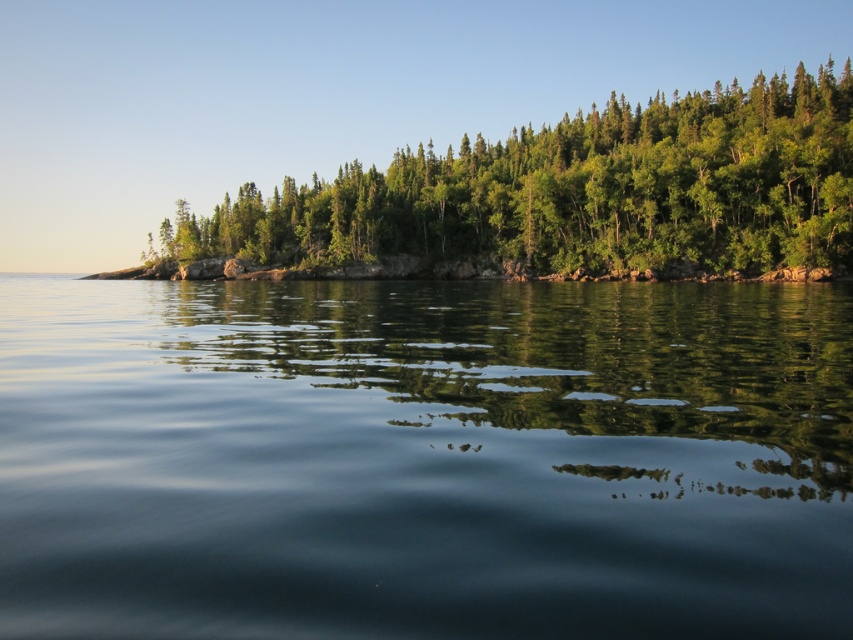
Is point (798, 468) in front of point (173, 250)?

Yes, point (798, 468) is closer to viewer.

Find the location of a particular element. The width and height of the screenshot is (853, 640). transparent water at center is located at coordinates (424, 460).